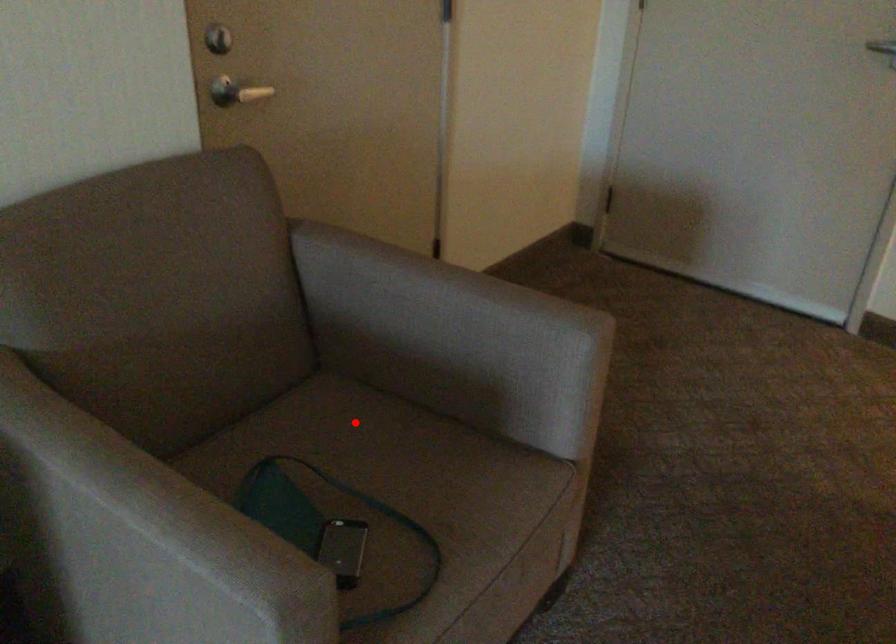
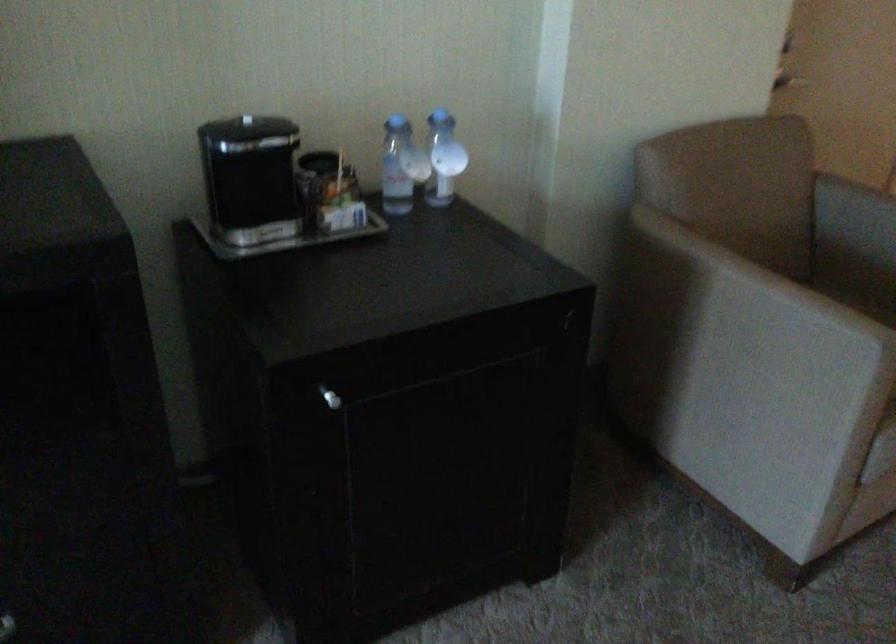
Question: I am providing you with two images of the same scene from different viewpoints. A red point is shown in image1. For the corresponding object point in image2, is it positioned nearer or farther from the camera?

Choices:
 (A) Nearer
 (B) Farther

Answer: (B)